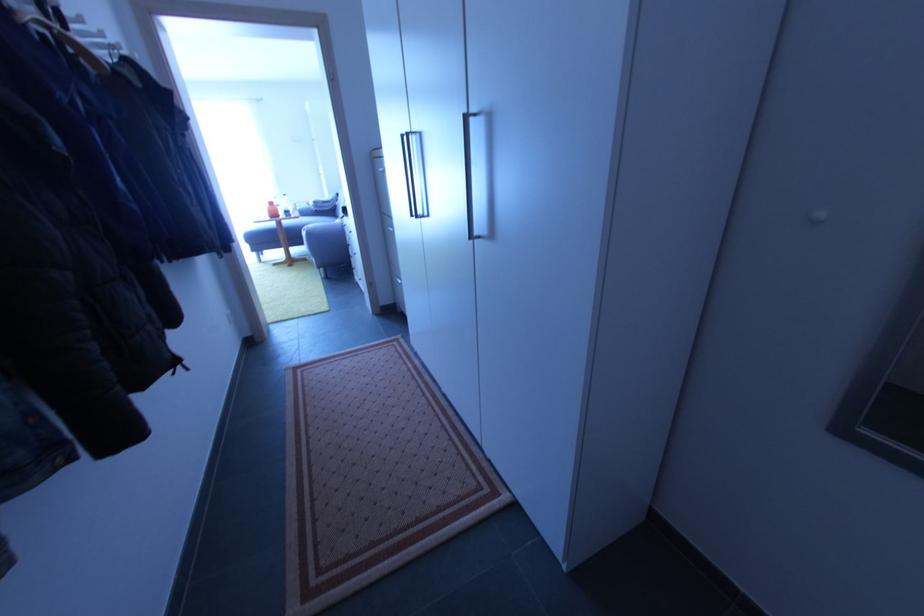
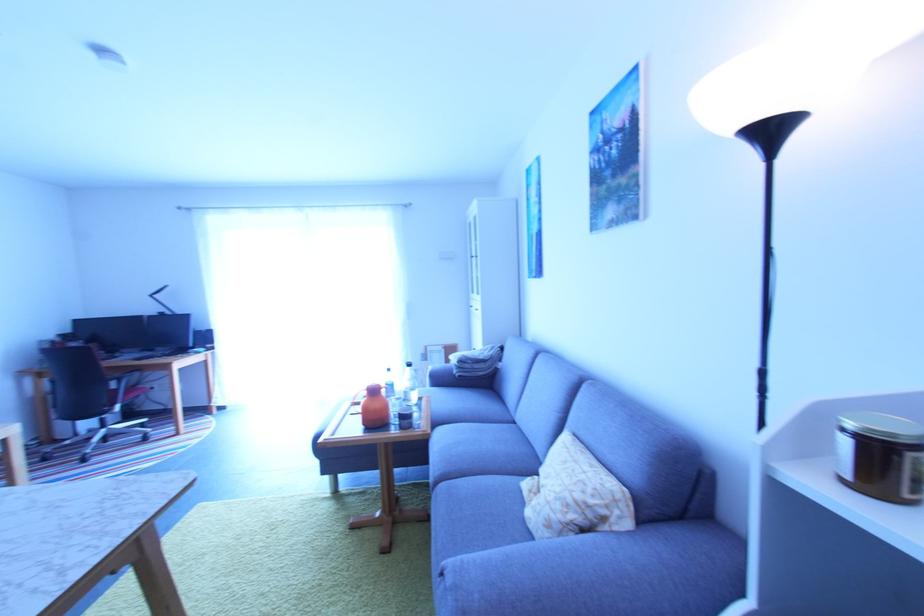
Which direction would the cameraman need to move to produce the second image?

The movement direction of the cameraman is left, forward.